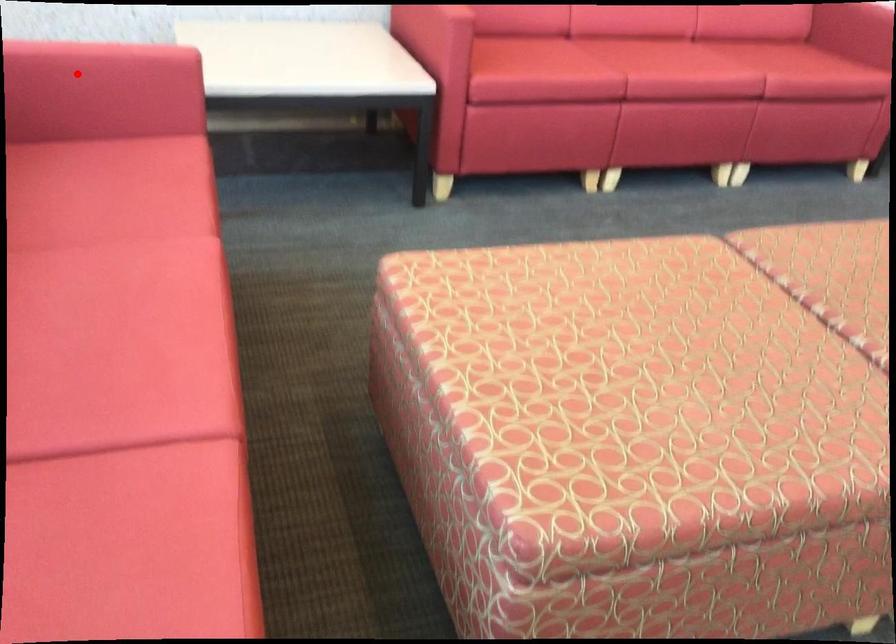
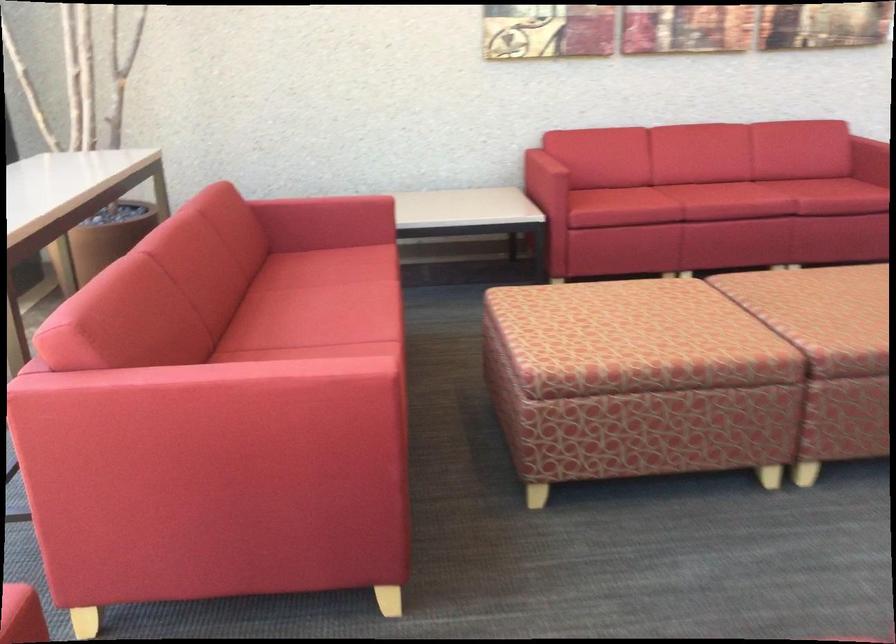
Question: I am providing you with two images of the same scene from different viewpoints. A red point is marked on the first image. Is the red point's position out of view in image 2?

Choices:
 (A) Yes
 (B) No

Answer: (B)